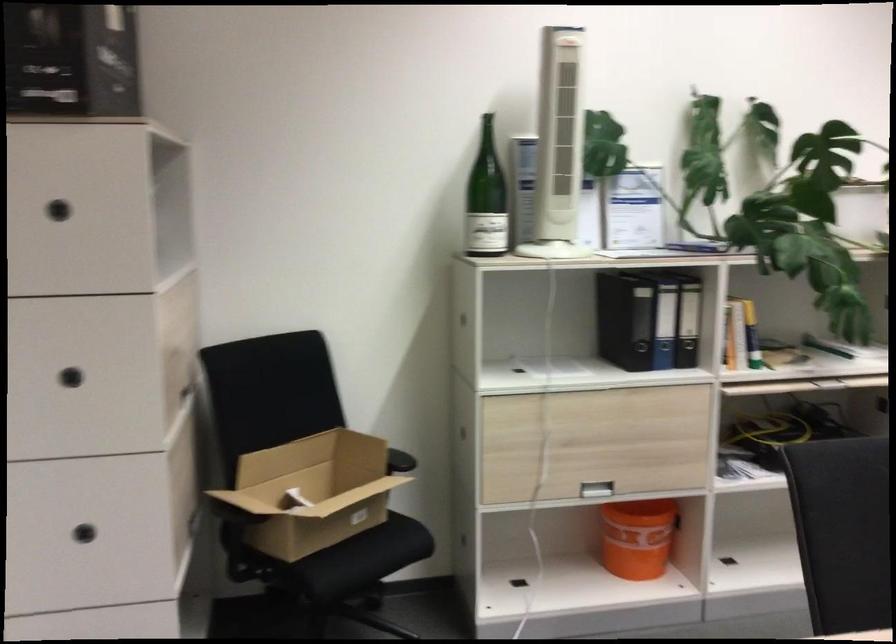
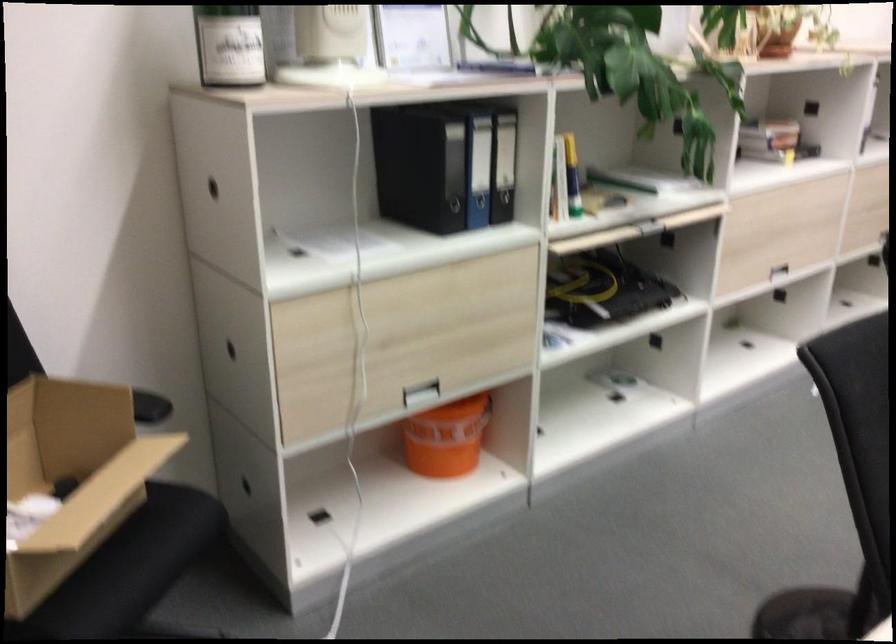
Find the pixel in the second image that matches [690,321] in the first image.

(504, 165)